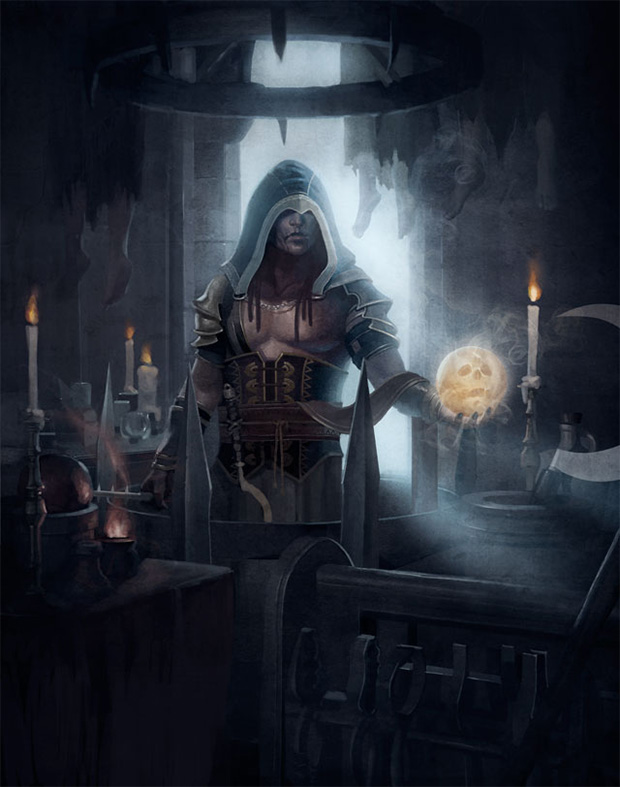
Locate an element on the screen. Image resolution: width=620 pixels, height=787 pixels. chest is located at coordinates (273, 315).